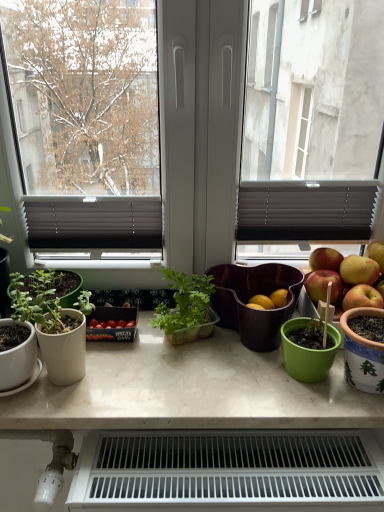
Question: From the image's perspective, is translucent plastic plant container at center, the first houseplant when ordered from right to left, positioned above or below matte purple salad bowl at center?

Choices:
 (A) above
 (B) below

Answer: (A)

Question: In terms of width, does translucent plastic plant container at center, which is the 2th houseplant in left-to-right order, look wider or thinner when compared to matte purple salad bowl at center?

Choices:
 (A) thin
 (B) wide

Answer: (A)

Question: Based on their relative distances, which object is farther from the white marble table at center?

Choices:
 (A) christmas-patterned ceramic pot at right
 (B) white plastic radiator at lower center
 (C) translucent plastic plant container at center, the first houseplant when ordered from right to left
 (D) matte purple salad bowl at center
 (E) matte white pot at left, which is the 2th houseplant from right to left

Answer: (A)

Question: Which object is positioned closest to the white plastic radiator at lower center?

Choices:
 (A) matte purple salad bowl at center
 (B) translucent plastic plant container at center, which is the 2th houseplant in left-to-right order
 (C) white marble table at center
 (D) christmas-patterned ceramic pot at right
 (E) matte white pot at left, which is the 2th houseplant from right to left

Answer: (C)